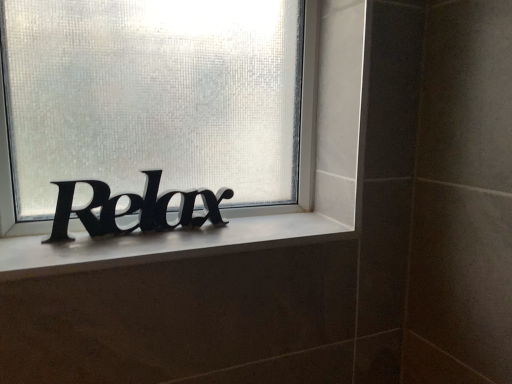
Where is `black matte sign at center`? Image resolution: width=512 pixels, height=384 pixels. black matte sign at center is located at coordinates (301, 123).

Describe the element at coordinates (133, 208) in the screenshot. I see `black matte lettering at center` at that location.

Locate an element on the screen. white matte window sill at center is located at coordinates (163, 244).

From the image's perspective, which object appears higher, black matte sign at center or black matte lettering at center?

black matte sign at center, from the image's perspective.

From the picture: Which is more to the right, black matte sign at center or black matte lettering at center?

black matte sign at center is more to the right.

Can you tell me how much black matte sign at center and black matte lettering at center differ in facing direction?

The facing directions of black matte sign at center and black matte lettering at center are 0.424 degrees apart.

Considering the sizes of objects black matte sign at center and black matte lettering at center in the image provided, who is smaller, black matte sign at center or black matte lettering at center?

With smaller size is black matte lettering at center.

From a real-world perspective, which object rests below the other?

From a 3D spatial view, black matte lettering at center is below.

Relative to black matte sign at center, is black matte lettering at center in front or behind?

black matte lettering at center is behind black matte sign at center.

Would you say black matte sign at center is part of black matte lettering at center's contents?

Actually, black matte sign at center is outside black matte lettering at center.

From the image's perspective, is black matte lettering at center on black matte sign at center?

No, from the image's perspective, black matte lettering at center is not over black matte sign at center.

Looking at their sizes, would you say black matte lettering at center is wider or thinner than white matte window sill at center?

Clearly, black matte lettering at center has less width compared to white matte window sill at center.

The image size is (512, 384). I want to click on window sill below the black matte lettering at center (from a real-world perspective), so click(163, 244).

Considering the sizes of black matte lettering at center and white matte window sill at center in the image, is black matte lettering at center bigger or smaller than white matte window sill at center?

Considering their sizes, black matte lettering at center takes up more space than white matte window sill at center.

Considering the positions of points (186, 216) and (58, 248), is point (186, 216) farther from camera compared to point (58, 248)?

Yes, it is behind point (58, 248).

Considering the relative sizes of white matte window sill at center and black matte sign at center in the image provided, is white matte window sill at center thinner than black matte sign at center?

Incorrect, the width of white matte window sill at center is not less than that of black matte sign at center.

Does white matte window sill at center come behind black matte sign at center?

No, white matte window sill at center is closer to the viewer.

The height and width of the screenshot is (384, 512). Identify the location of window behind the white matte window sill at center. (301, 123).

Based on the photo, is white matte window sill at center spatially inside black matte sign at center, or outside of it?

white matte window sill at center is located beyond the bounds of black matte sign at center.

How far apart are white matte window sill at center and black matte lettering at center?

They are 2.73 inches apart.

From a real-world perspective, which is physically above, white matte window sill at center or black matte lettering at center?

A: From a 3D spatial view, black matte lettering at center is above.

Visually, is white matte window sill at center positioned to the left or to the right of black matte lettering at center?

From the image, it's evident that white matte window sill at center is to the right of black matte lettering at center.

Would you say white matte window sill at center is a long distance from black matte lettering at center?

No, white matte window sill at center is not far away from black matte lettering at center.

How far apart are black matte sign at center and white matte window sill at center?

The distance of black matte sign at center from white matte window sill at center is 9.55 inches.

Are black matte sign at center and white matte window sill at center far apart?

No, black matte sign at center is not far from white matte window sill at center.

From a real-world perspective, which object rests below the other?

white matte window sill at center is physically lower.

Who is shorter, black matte sign at center or white matte window sill at center?

With less height is white matte window sill at center.

You are a GUI agent. You are given a task and a screenshot of the screen. Output one action in this format:
    pyautogui.click(x=<x>, y=<y>)
    Task: Click on the lettering behind the black matte sign at center
    
    Given the screenshot: What is the action you would take?
    pyautogui.click(x=133, y=208)

You are a GUI agent. You are given a task and a screenshot of the screen. Output one action in this format:
    pyautogui.click(x=<x>, y=<y>)
    Task: Click on the window located on the right of black matte lettering at center
    
    Given the screenshot: What is the action you would take?
    pyautogui.click(x=301, y=123)

Looking at the image, which one is located further to white matte window sill at center, black matte sign at center or black matte lettering at center?

black matte sign at center is positioned further to the anchor white matte window sill at center.

From the image, which object appears to be farther from black matte sign at center, black matte lettering at center or white matte window sill at center?

white matte window sill at center.

Estimate the real-world distances between objects in this image. Which object is closer to black matte sign at center, white matte window sill at center or black matte lettering at center?

black matte lettering at center lies closer to black matte sign at center than the other object.

Based on their spatial positions, is black matte lettering at center or black matte sign at center further from white matte window sill at center?

Among the two, black matte sign at center is located further to white matte window sill at center.

Looking at the image, which one is located further to black matte lettering at center, black matte sign at center or white matte window sill at center?

black matte sign at center.

Estimate the real-world distances between objects in this image. Which object is further from black matte lettering at center, white matte window sill at center or black matte sign at center?

black matte sign at center lies further to black matte lettering at center than the other object.

Where is `lettering between black matte sign at center and white matte window sill at center from top to bottom`? lettering between black matte sign at center and white matte window sill at center from top to bottom is located at coordinates (133, 208).